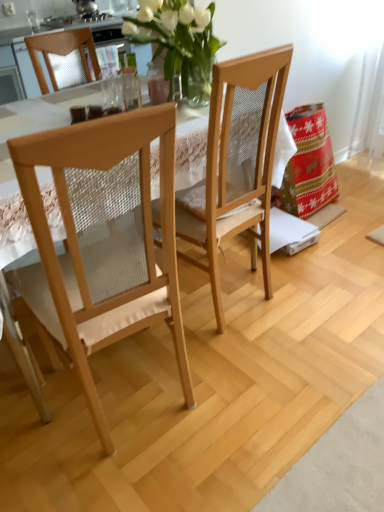
At what (x,y) coordinates should I click in order to perform the action: click on spots to the right of light brown wood chair at center, acting as the 1th chair starting from the right. Please return your answer as a coordinate pair (x, y). Looking at the image, I should click on (306, 294).